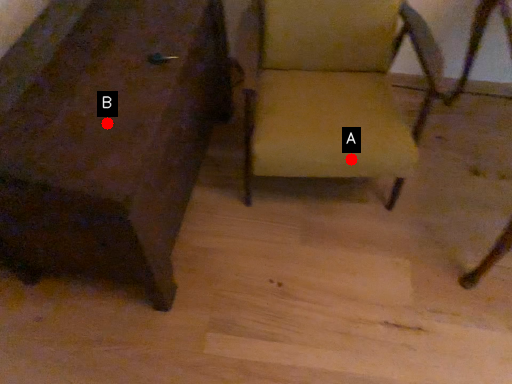
Question: Two points are circled on the image, labeled by A and B beside each circle. Which point is closer to the camera?

Choices:
 (A) A is closer
 (B) B is closer

Answer: (B)